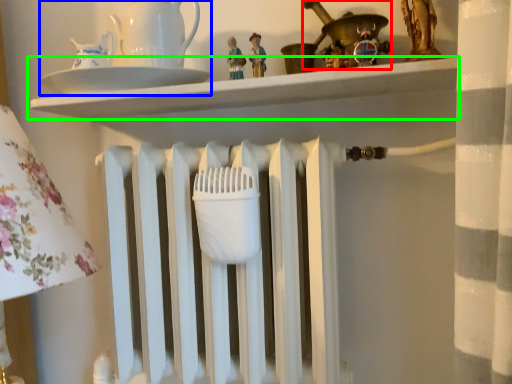
Question: Estimate the real-world distances between objects in this image. Which object is farther from toy (highlighted by a red box), tea set (highlighted by a blue box) or shelf (highlighted by a green box)?

Choices:
 (A) tea set
 (B) shelf

Answer: (A)